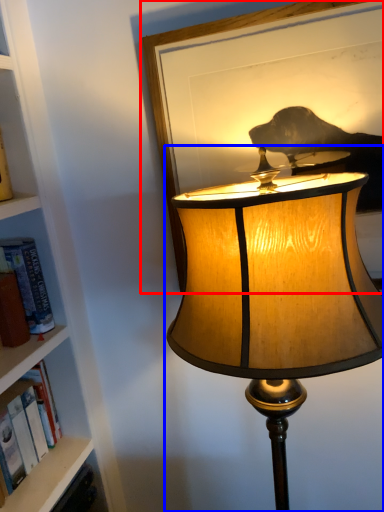
Question: Which point is closer to the camera, picture frame (highlighted by a red box) or lamp (highlighted by a blue box)?

Choices:
 (A) picture frame
 (B) lamp

Answer: (B)